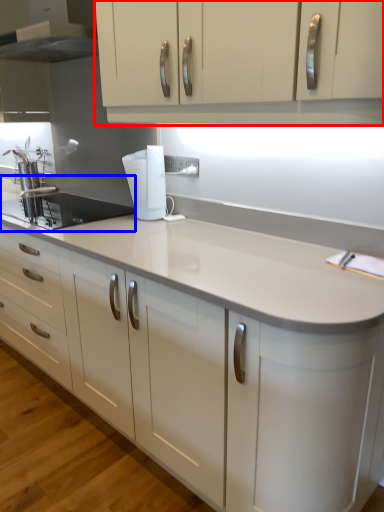
Question: Among these objects, which one is nearest to the camera, cabinetry (highlighted by a red box) or sink (highlighted by a blue box)?

Choices:
 (A) cabinetry
 (B) sink

Answer: (A)